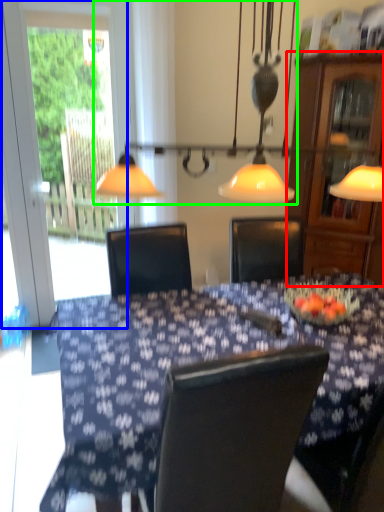
Question: Estimate the real-world distances between objects in this image. Which object is closer to cabinetry (highlighted by a red box), screen door (highlighted by a blue box) or lamp (highlighted by a green box)?

Choices:
 (A) screen door
 (B) lamp

Answer: (B)